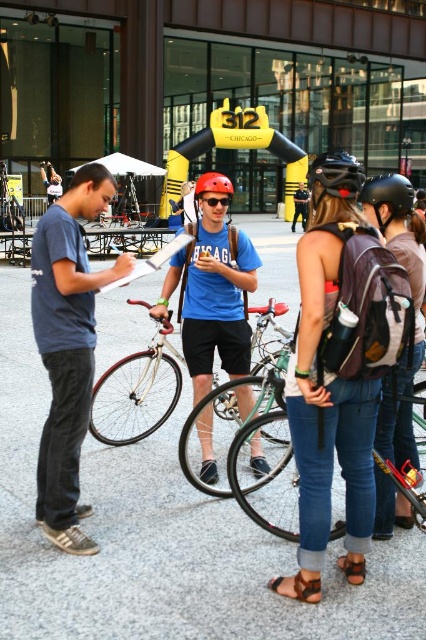
Based on the photo, you are organizing a cycling event and need to distribute backpacks and helmets. You have a limited space in your storage container. Which item, the matte black backpack at center or the shiny red helmet at center, will take up less space?

The matte black backpack at center has a smaller size compared to the shiny red helmet at center, so it will take up less space in the storage container.